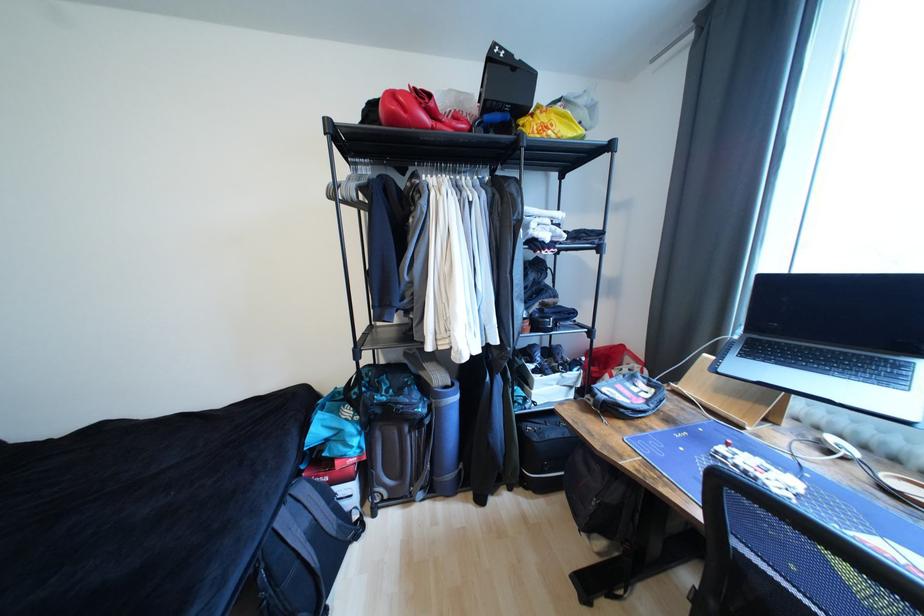
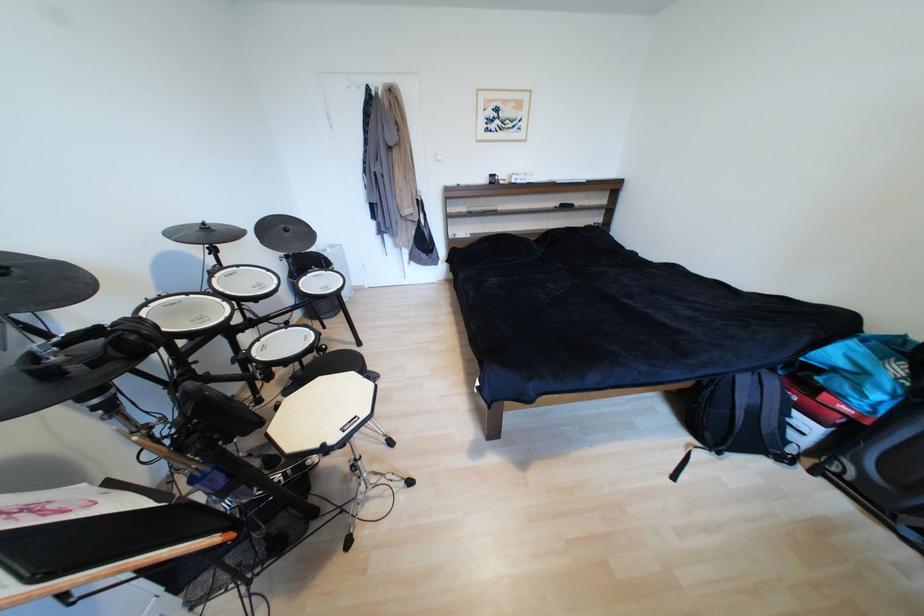
The images are taken continuously from a first-person perspective. In which direction is your viewpoint rotating?

The camera rotated toward left-down.